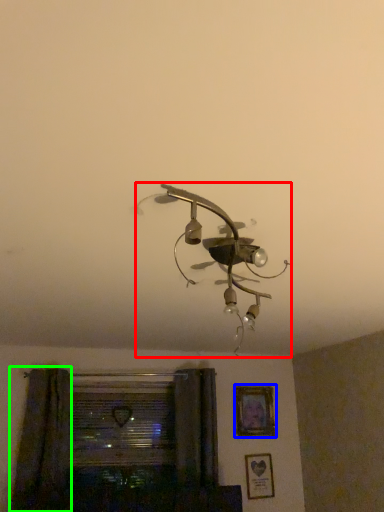
Question: Which is nearer to the lamp (highlighted by a red box)? picture frame (highlighted by a blue box) or curtain (highlighted by a green box).

Choices:
 (A) picture frame
 (B) curtain

Answer: (B)